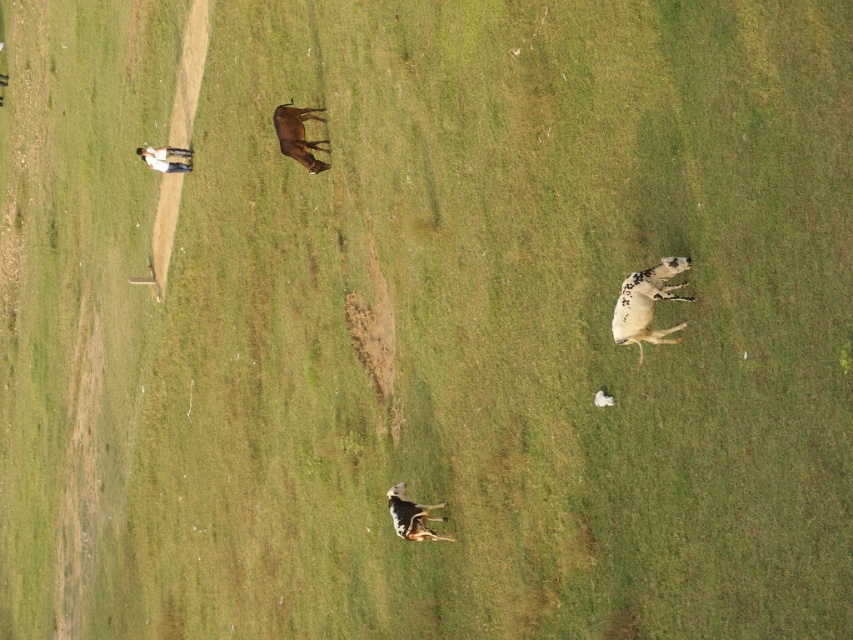
Question: Does brown glossy cow at upper center have a smaller size compared to spotted fur cow at center?

Choices:
 (A) yes
 (B) no

Answer: (B)

Question: Which of the following is the closest to the observer?

Choices:
 (A) spotted fur cow at center
 (B) white speckled fur at lower right
 (C) white glossy cow at upper left

Answer: (B)

Question: Among these objects, which one is farthest from the camera?

Choices:
 (A) white speckled fur at lower right
 (B) brown glossy cow at upper center
 (C) white glossy cow at upper left
 (D) spotted fur cow at center

Answer: (C)

Question: Estimate the real-world distances between objects in this image. Which object is closer to the brown glossy cow at upper center?

Choices:
 (A) spotted fur cow at center
 (B) white glossy cow at upper left

Answer: (A)

Question: Considering the relative positions of white speckled fur at lower right and brown glossy cow at upper center in the image provided, where is white speckled fur at lower right located with respect to brown glossy cow at upper center?

Choices:
 (A) above
 (B) below

Answer: (B)

Question: Is white speckled fur at lower right to the left of brown glossy cow at upper center from the viewer's perspective?

Choices:
 (A) yes
 (B) no

Answer: (B)